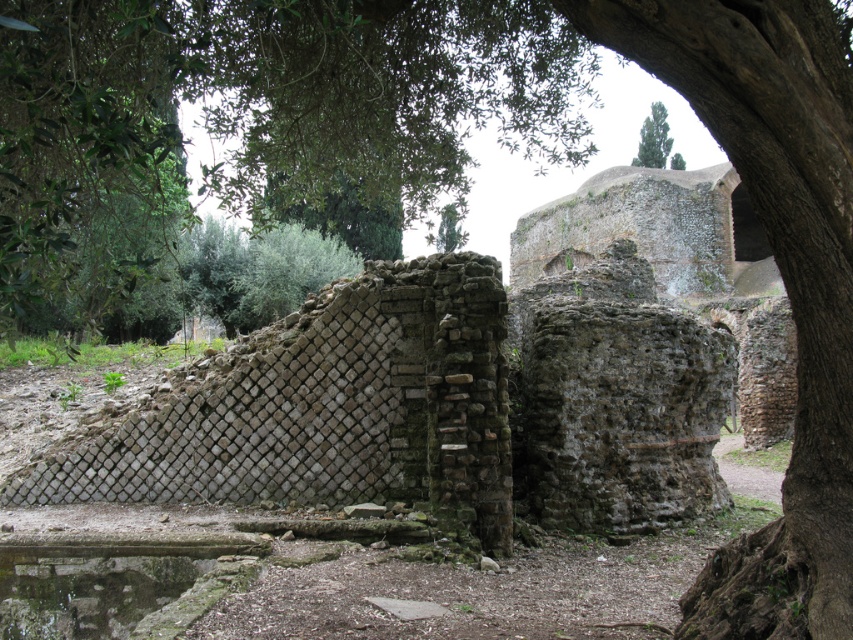
Question: Among these objects, which one is nearest to the camera?

Choices:
 (A) green leafy tree at upper left
 (B) green leafy tree at upper center

Answer: (A)

Question: Among these objects, which one is farthest from the camera?

Choices:
 (A) green mossy stone at lower left
 (B) green leafy tree at upper center

Answer: (B)

Question: Which point is closer to the camera?

Choices:
 (A) green mossy stone at lower left
 (B) green leafy tree at upper center

Answer: (A)

Question: Does green leafy tree at upper left appear over green leafy tree at upper center?

Choices:
 (A) no
 (B) yes

Answer: (A)

Question: Is green leafy tree at upper left to the right of green mossy stone at lower left from the viewer's perspective?

Choices:
 (A) yes
 (B) no

Answer: (B)

Question: From the image, what is the correct spatial relationship of green leafy tree at upper left in relation to green mossy stone at lower left?

Choices:
 (A) above
 (B) below

Answer: (A)